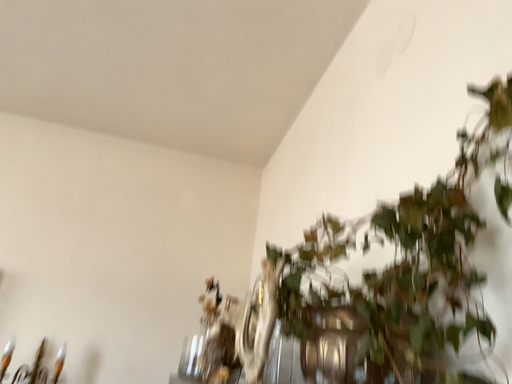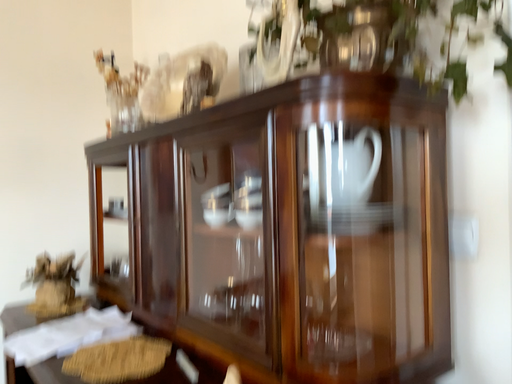
Question: How did the camera likely rotate when shooting the video?

Choices:
 (A) rotated upward
 (B) rotated downward

Answer: (B)